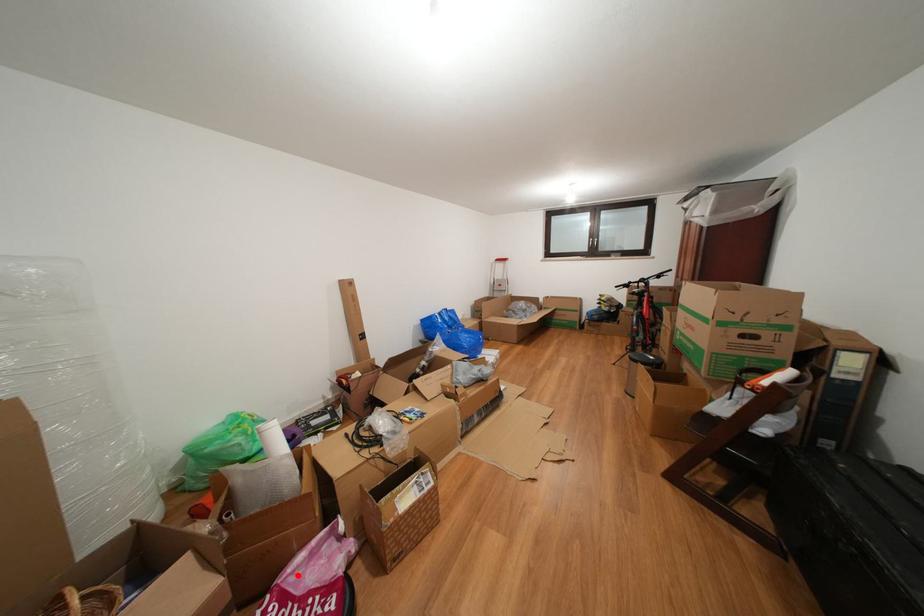
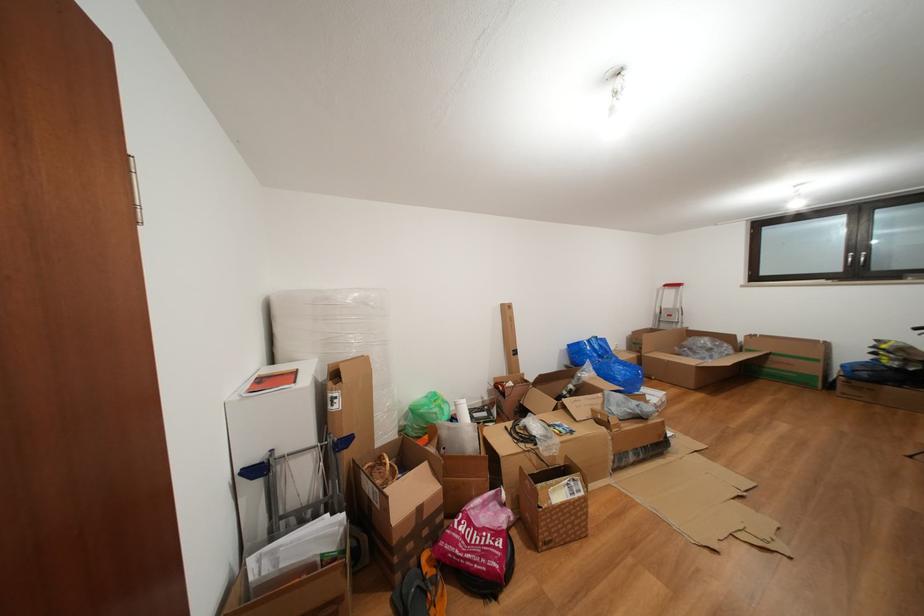
Question: I am providing you with two images of the same scene from different viewpoints. Image1 has a red point marked. In image2, the corresponding 3D location appears at what relative position? Reply with the corresponding letter.

Choices:
 (A) Closer
 (B) Farther

Answer: (B)